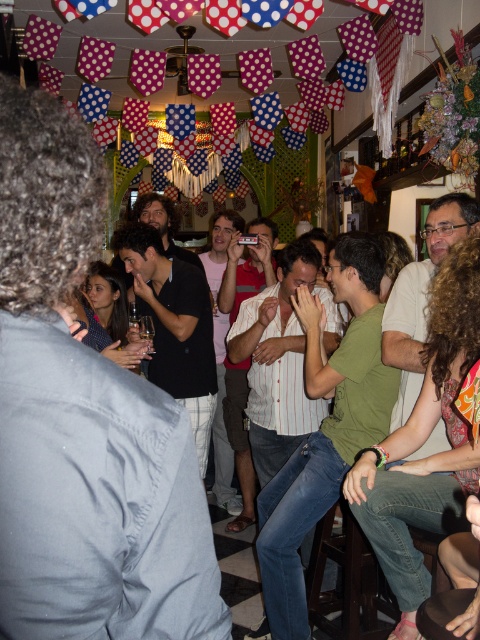
You are at a party and want to take a photo of the dark blue shirt at center and the black matte shirt at center. Which one is positioned higher in the image?

The dark blue shirt at center is positioned higher than the black matte shirt at center.

Looking at this image, you are at a party and want to see the black matte shirt at center behind the dark blue shirt at center. What should you do?

The dark blue shirt at center is blocking the view of the black matte shirt at center, so you should move around or step back to get a better view.

You are a guest at the party and need to choose between the white striped shirt at center and the pink cotton shirt at center. Which one is smaller in size?

The white striped shirt at center is smaller in size compared to the pink cotton shirt at center.